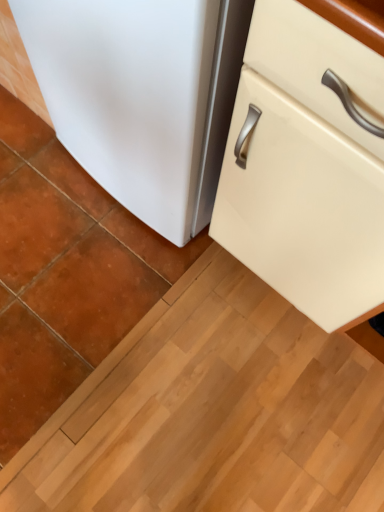
Question: Does point (173, 224) appear closer or farther from the camera than point (228, 183)?

Choices:
 (A) farther
 (B) closer

Answer: (A)

Question: Looking at the image, does white matte refrigerator at lower left seem bigger or smaller compared to matte cream cabinet at lower right?

Choices:
 (A) small
 (B) big

Answer: (A)

Question: Is white matte refrigerator at lower left taller or shorter than matte cream cabinet at lower right?

Choices:
 (A) short
 (B) tall

Answer: (A)

Question: Considering their positions, is matte cream cabinet at lower right located in front of or behind white matte refrigerator at lower left?

Choices:
 (A) front
 (B) behind

Answer: (A)

Question: From a real-world perspective, relative to white matte refrigerator at lower left, is matte cream cabinet at lower right vertically above or below?

Choices:
 (A) above
 (B) below

Answer: (A)

Question: From their relative heights in the image, would you say matte cream cabinet at lower right is taller or shorter than white matte refrigerator at lower left?

Choices:
 (A) short
 (B) tall

Answer: (B)

Question: From the image's perspective, relative to white matte refrigerator at lower left, is matte cream cabinet at lower right above or below?

Choices:
 (A) above
 (B) below

Answer: (B)